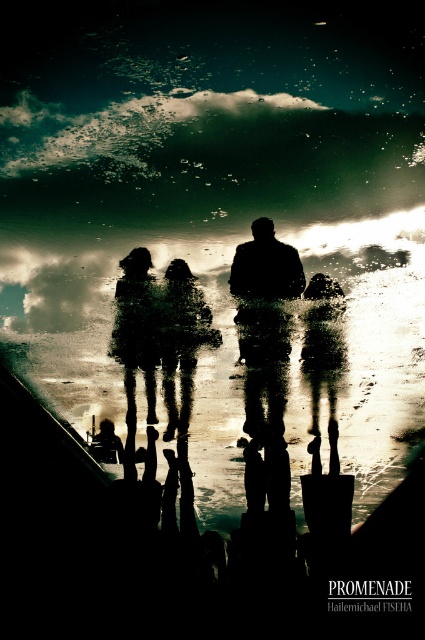
You are an observer standing on the waterfront promenade. You notice two objects in the scene described as the matte black figure at center and the matte black pants at center. Which of these two objects appears wider from your vantage point?

The matte black figure at center appears wider than the matte black pants at center because its width surpasses the pants.